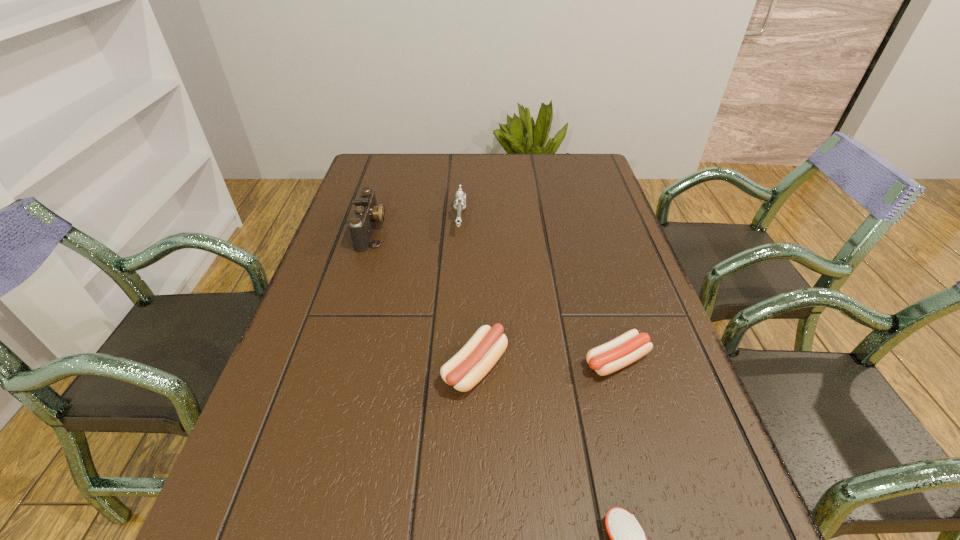
Find the location of `vacant area that satisfies the following two spatial constraints: 1. on the front-facing side of the left sausage; 2. on the right side of the leftmost object`. vacant area that satisfies the following two spatial constraints: 1. on the front-facing side of the left sausage; 2. on the right side of the leftmost object is located at coordinates (329, 368).

At what (x,y) coordinates should I click in order to perform the action: click on vacant area in the image that satisfies the following two spatial constraints: 1. aimed along the barrel of the taller sausage; 2. on the left side of the gun. Please return your answer as a coordinate pair (x, y). This screenshot has height=540, width=960. Looking at the image, I should click on (452, 368).

Where is `vacant point that satisfies the following two spatial constraints: 1. aimed along the barrel of the gun; 2. on the front-facing side of the leftmost object`? Image resolution: width=960 pixels, height=540 pixels. vacant point that satisfies the following two spatial constraints: 1. aimed along the barrel of the gun; 2. on the front-facing side of the leftmost object is located at coordinates (460, 231).